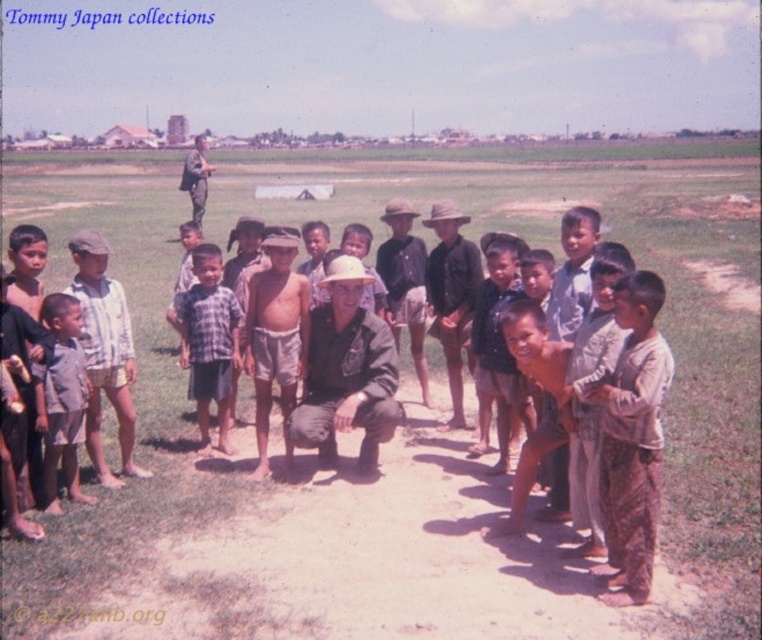
Is point (612, 456) positioned in front of point (346, 378)?

Yes, point (612, 456) is closer to viewer.

Between brown woven pants at lower right and dark green uniform at center, which one appears on the right side from the viewer's perspective?

brown woven pants at lower right is more to the right.

The width and height of the screenshot is (762, 640). I want to click on brown woven pants at lower right, so click(632, 440).

How distant is light brown shorts at center from brown leather hat at center?

light brown shorts at center and brown leather hat at center are 5.52 feet apart.

Based on the photo, between light brown shorts at center and brown leather hat at center, which one appears on the left side from the viewer's perspective?

Positioned to the left is light brown shorts at center.

This screenshot has width=762, height=640. What do you see at coordinates (274, 337) in the screenshot? I see `light brown shorts at center` at bounding box center [274, 337].

Identify the location of light brown shorts at center. This screenshot has height=640, width=762. (274, 337).

Does point (219, 412) lie in front of point (37, 429)?

That is False.

Between checkered fabric shirt at center and light brown cotton shirt at lower left, which one is positioned lower?

light brown cotton shirt at lower left is lower down.

Is point (221, 371) closer to camera compared to point (53, 449)?

That is False.

I want to click on checkered fabric shirt at center, so click(x=207, y=342).